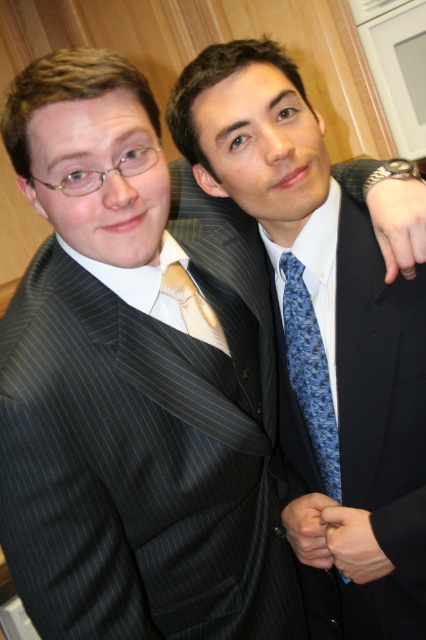
Can you confirm if pinstriped suit at center is thinner than satin gold tie at center?

In fact, pinstriped suit at center might be wider than satin gold tie at center.

Which is above, pinstriped suit at center or satin gold tie at center?

satin gold tie at center is above.

Which is behind, point (417, 508) or point (198, 333)?

The point (198, 333) is behind.

Identify the location of pinstriped suit at center. pos(356,417).

Is pinstriped suit at center taller than blue printed tie at center?

Indeed, pinstriped suit at center has a greater height compared to blue printed tie at center.

Is pinstriped suit at center thinner than blue printed tie at center?

In fact, pinstriped suit at center might be wider than blue printed tie at center.

Find the location of `pinstriped suit at center`. pinstriped suit at center is located at coordinates (356, 417).

Does blue printed tie at center have a lesser height compared to satin gold tie at center?

In fact, blue printed tie at center may be taller than satin gold tie at center.

Who is more forward, (330, 472) or (187, 292)?

Point (187, 292) is in front.

Which is in front, point (284, 292) or point (187, 294)?

Point (187, 294) is in front.

The height and width of the screenshot is (640, 426). In order to click on blue printed tie at center in this screenshot , I will do `click(310, 372)`.